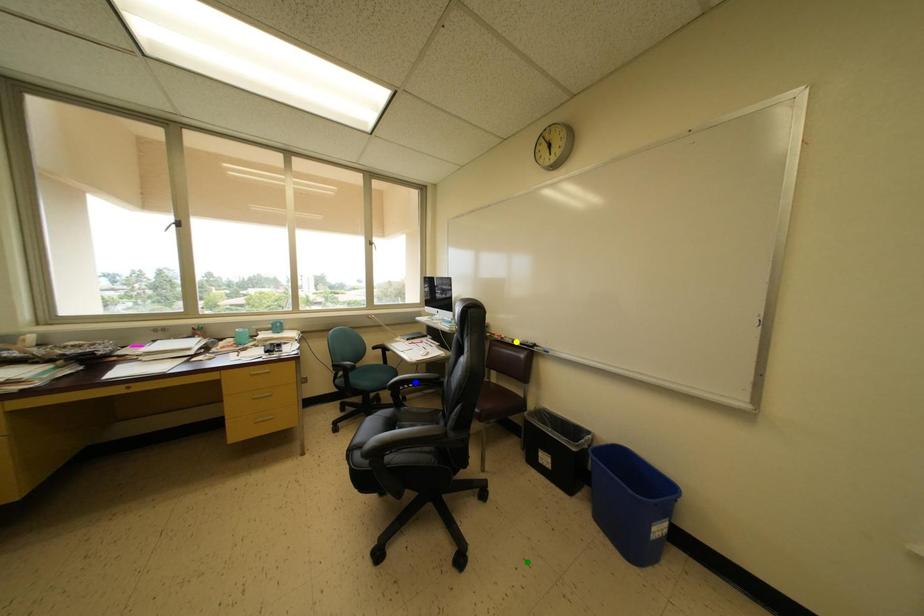
Order these from nearest to farthest:
green point
blue point
yellow point

green point → yellow point → blue point